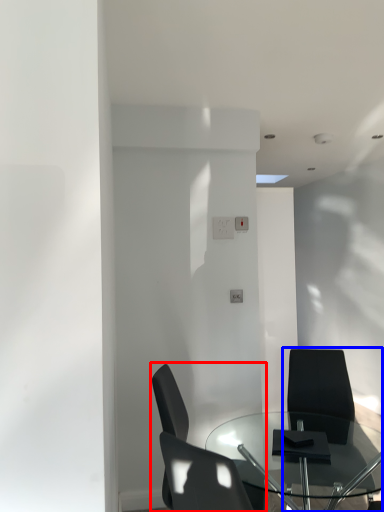
Question: Which object is closer to the camera taking this photo, chair (highlighted by a red box) or chair (highlighted by a blue box)?

Choices:
 (A) chair
 (B) chair

Answer: (A)